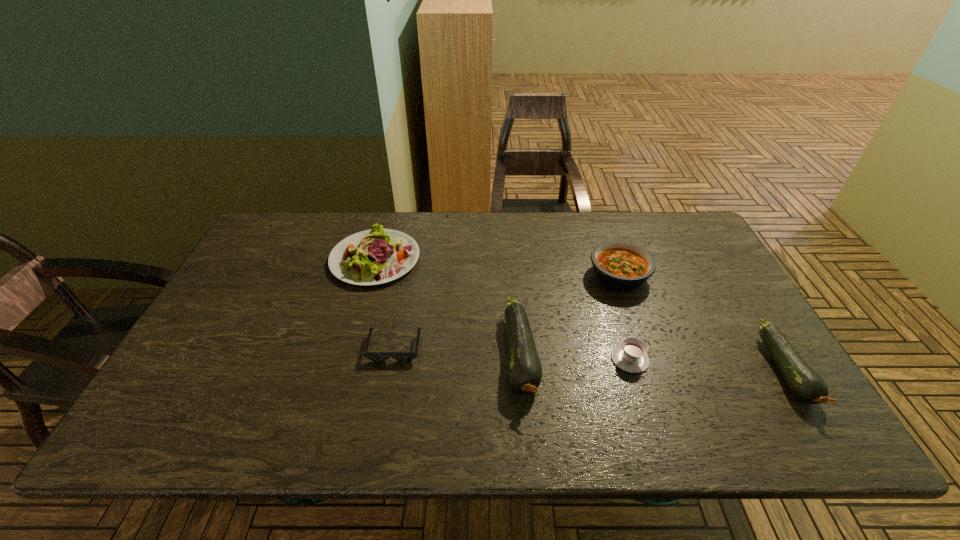
This screenshot has width=960, height=540. I want to click on the tallest object, so click(524, 370).

What are the coordinates of `the fourth object from right to left` in the screenshot? It's located at (524, 370).

This screenshot has width=960, height=540. What are the coordinates of `the shorter zucchini` in the screenshot? It's located at (806, 384).

Find the location of a particular element. This screenshot has width=960, height=540. the rightmost object is located at coordinates (806, 384).

You are a GUI agent. You are given a task and a screenshot of the screen. Output one action in this format:
    pyautogui.click(x=<x>, y=<y>)
    Task: Click on the salad plate
    Image resolution: width=960 pixels, height=540 pixels.
    Given the screenshot: What is the action you would take?
    pyautogui.click(x=375, y=256)

Locate an element on the screen. The height and width of the screenshot is (540, 960). stew is located at coordinates (620, 265).

Find the location of a particular element. This screenshot has height=540, width=960. teacup is located at coordinates (630, 356).

Locate an element on the screen. The image size is (960, 540). sunglasses is located at coordinates (373, 356).

What are the coordinates of `vacant space situated 0.200m on the left of the salad plate` in the screenshot? It's located at (266, 259).

Locate an element on the screen. The image size is (960, 540). free point located on the left of the stew is located at coordinates (507, 275).